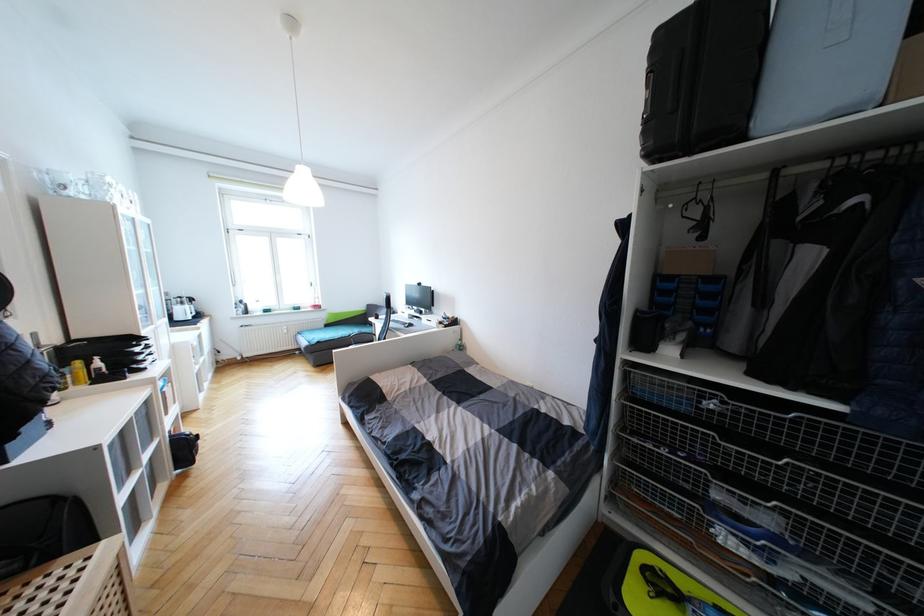
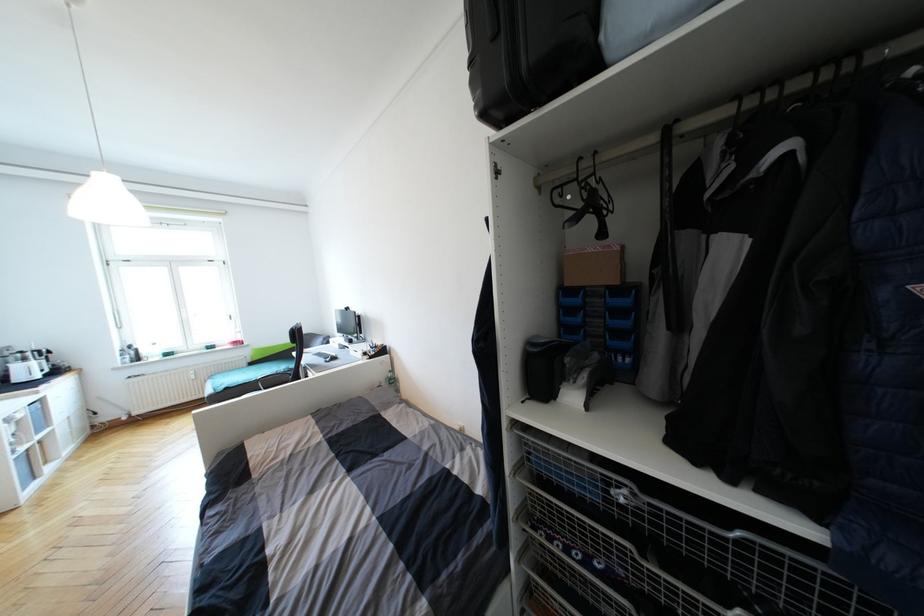
Where in the second image is the point corresponding to the point at 465,349 from the first image?

(395, 382)